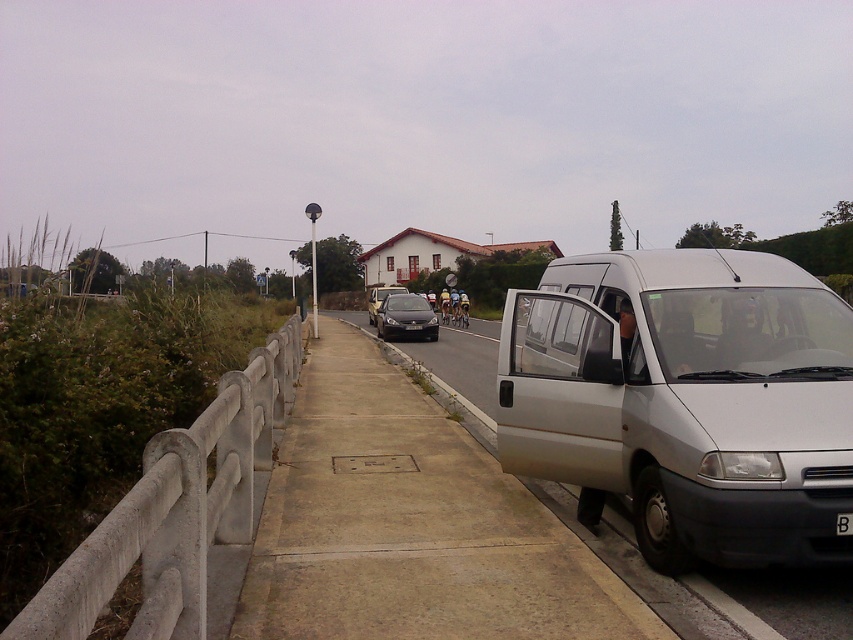
You are driving a car and see the satin black sedan at center and the satin silver van at center. Which vehicle is blocking your view of the other?

The satin black sedan at center is blocking your view of the satin silver van at center because it is positioned in front of it.

You are a pedestrian standing on the sidewalk next to the concrete at left. You need to reach the black plastic license plate at center to read its number. Can you walk directly to it without crossing any obstacles?

The concrete at left and black plastic license plate at center are 5.97 meters apart. Since there are no mentioned obstacles between them, you can walk directly to the license plate.